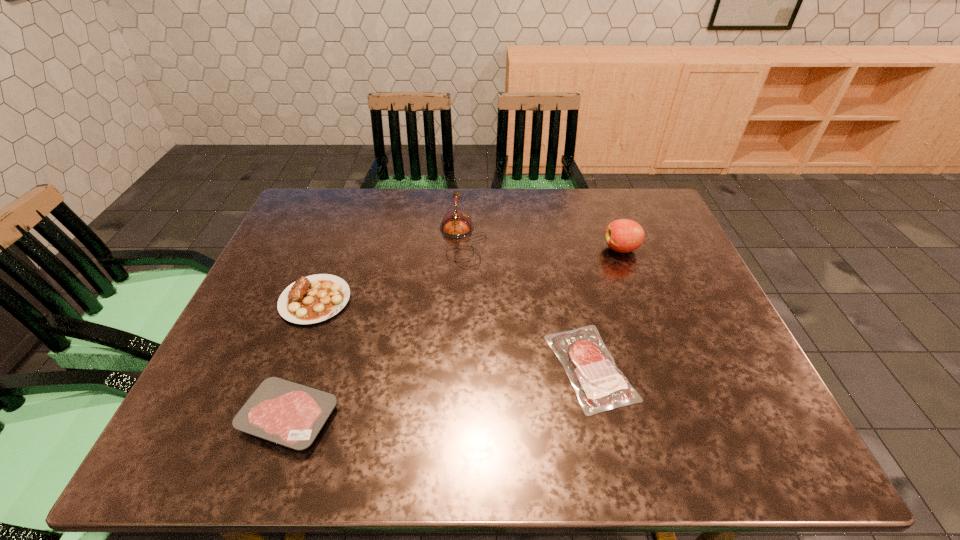
This screenshot has width=960, height=540. I want to click on vacant area in the image that satisfies the following two spatial constraints: 1. on the rotary dial of the telephone; 2. on the front side of the third shortest object, so click(x=460, y=300).